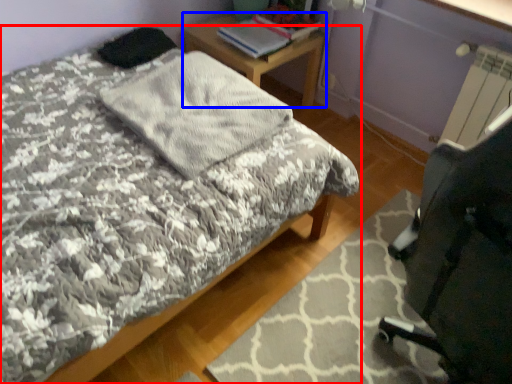
Question: Which object is closer to the camera taking this photo, bed (highlighted by a red box) or desk (highlighted by a blue box)?

Choices:
 (A) bed
 (B) desk

Answer: (A)